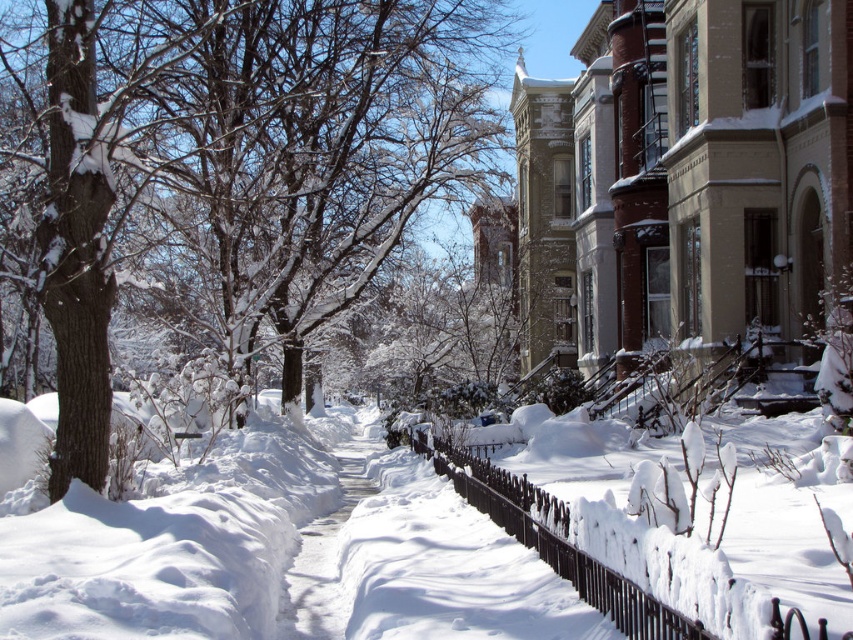
Does snow-covered tree at center come in front of white snow at center?

No, it is not.

This screenshot has width=853, height=640. What are the coordinates of `snow-covered tree at center` in the screenshot? It's located at (242, 163).

Does point (54, 339) come closer to viewer compared to point (526, 620)?

That is False.

Can you confirm if snow-covered tree at center is positioned to the left of white fluffy snow at center?

Correct, you'll find snow-covered tree at center to the left of white fluffy snow at center.

Locate an element on the screen. snow-covered tree at center is located at coordinates (242, 163).

Locate an element on the screen. This screenshot has height=640, width=853. snow-covered tree at center is located at coordinates (242, 163).

Based on the photo, does snow-covered tree at center appear under black wrought iron fence at center?

Actually, snow-covered tree at center is above black wrought iron fence at center.

Can you confirm if snow-covered tree at center is smaller than black wrought iron fence at center?

No, snow-covered tree at center is not smaller than black wrought iron fence at center.

Is point (271, 93) positioned behind point (619, 588)?

Yes.

Identify the location of snow-covered tree at center. The image size is (853, 640). (242, 163).